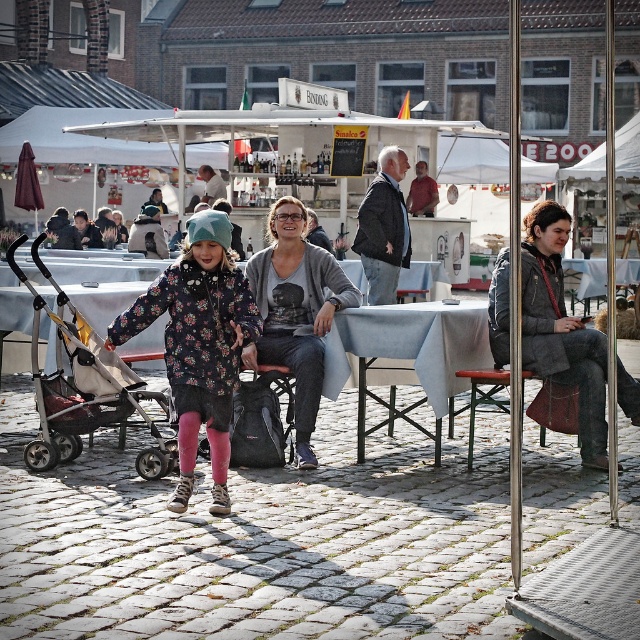
Question: Estimate the real-world distances between objects in this image. Which object is closer to the black plastic baby carriage at center?

Choices:
 (A) gray cardigan at center
 (B) dark gray jacket at center
 (C) floral-patterned coat at center
 (D) light blue fabric table at center

Answer: (C)

Question: Estimate the real-world distances between objects in this image. Which object is closer to the gray cardigan at center?

Choices:
 (A) light blue fabric table at center
 (B) dark gray jacket at center
 (C) floral-patterned coat at center

Answer: (A)

Question: Does gray cardigan at center have a greater width compared to black plastic baby carriage at center?

Choices:
 (A) no
 (B) yes

Answer: (A)

Question: Which of the following is the closest to the observer?

Choices:
 (A) gray cardigan at center
 (B) dark gray jacket at center

Answer: (A)

Question: Is light blue fabric table at center below gray cardigan at center?

Choices:
 (A) no
 (B) yes

Answer: (B)

Question: Can you confirm if gray woolen coat at center is wider than dark gray jacket at center?

Choices:
 (A) no
 (B) yes

Answer: (B)